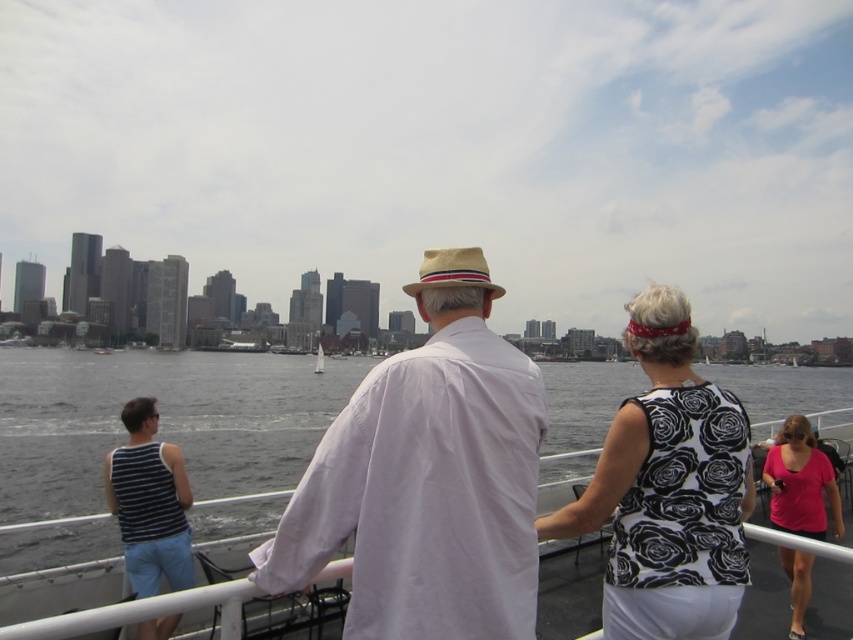
Does black floral tank top at center have a larger size compared to white sailboat at center?

No.

Is black floral tank top at center smaller than white sailboat at center?

Indeed, black floral tank top at center has a smaller size compared to white sailboat at center.

Is point (651, 522) positioned in front of point (323, 369)?

Yes, point (651, 522) is in front of point (323, 369).

Where is `black floral tank top at center`? This screenshot has width=853, height=640. black floral tank top at center is located at coordinates (668, 490).

Which is behind, point (299, 528) or point (167, 468)?

Point (167, 468)

Between point (405, 595) and point (169, 486), which one is positioned in front?

Point (405, 595) is more forward.

Image resolution: width=853 pixels, height=640 pixels. I want to click on white cotton shirt at center, so click(x=427, y=477).

Is white cotton shirt at center taller than black floral tank top at center?

Correct, white cotton shirt at center is much taller as black floral tank top at center.

Which is below, white cotton shirt at center or black floral tank top at center?

Positioned lower is black floral tank top at center.

Identify the location of white cotton shirt at center. click(427, 477).

The width and height of the screenshot is (853, 640). I want to click on white cotton shirt at center, so click(427, 477).